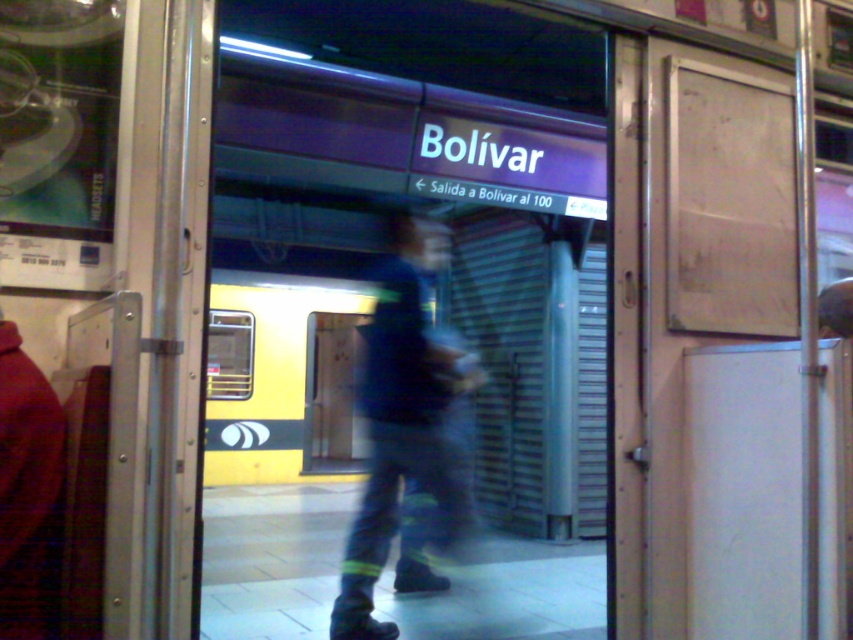
You are a passenger at the Bolivar subway station. You need to exit through the white matte door at right but first must pass by the blue fabric pants at center. Can you fit through the door after passing the pants?

The white matte door at right is smaller than the blue fabric pants at center. Since the door is smaller, it might not be wide enough to allow passage after accounting for the space occupied by the pants.

You are a passenger at the Bolivar subway station. You want to exit through the white matte door at right but need to pass by the blue fabric pants at center. Can you walk directly to the door without going around the person wearing the pants?

The white matte door at right is closer to the viewer than blue fabric pants at center, so you can walk directly to the door without needing to go around the person wearing the pants.